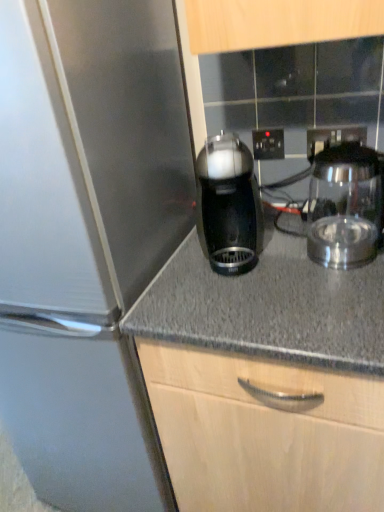
The width and height of the screenshot is (384, 512). In order to click on free space above transparent glass carafe at right, the 2th kitchen appliance in the left-to-right sequence (from a real-world perspective) in this screenshot , I will do `click(347, 155)`.